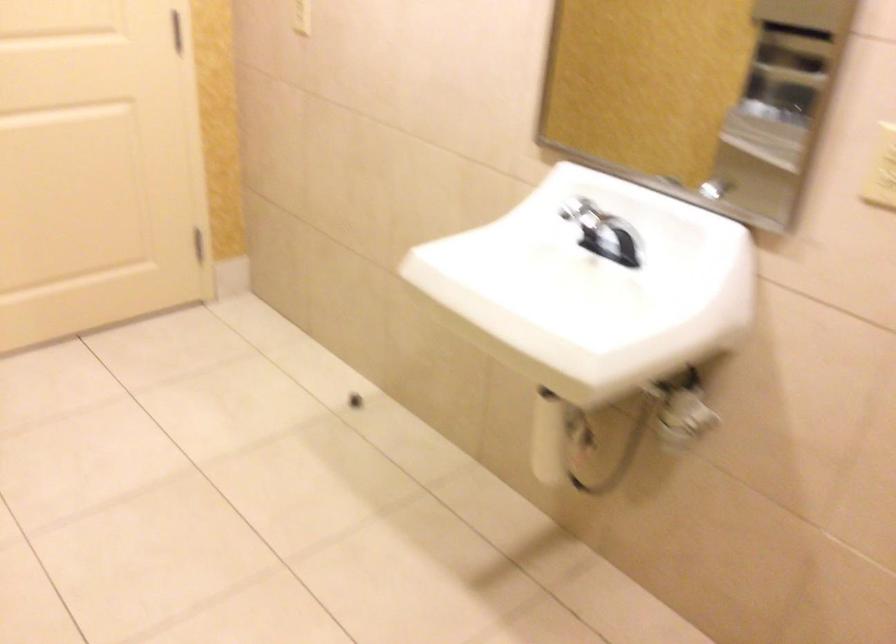
Image resolution: width=896 pixels, height=644 pixels. Describe the element at coordinates (300, 17) in the screenshot. I see `a light switch` at that location.